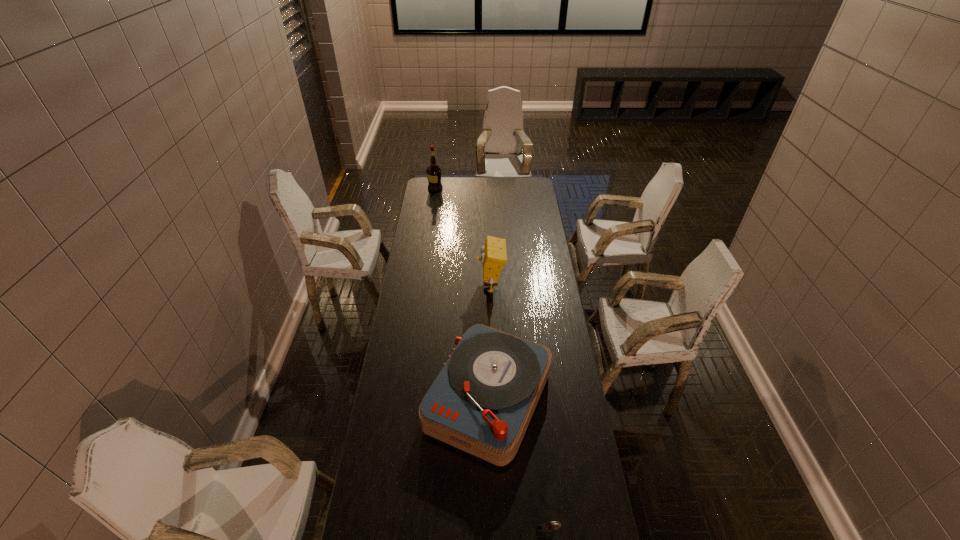
This screenshot has height=540, width=960. I want to click on the tallest object, so click(x=433, y=172).

Locate an element on the screen. the farthest object is located at coordinates (433, 172).

Where is `the third shortest object`? the third shortest object is located at coordinates (493, 254).

Locate an element on the screen. The width and height of the screenshot is (960, 540). the second farthest object is located at coordinates (493, 254).

Image resolution: width=960 pixels, height=540 pixels. Find the location of `the third tallest object`. the third tallest object is located at coordinates (482, 401).

Identify the location of the third farthest object. Image resolution: width=960 pixels, height=540 pixels. (482, 401).

Identify the location of the nearest object. (544, 530).

Locate an element on the screen. The width and height of the screenshot is (960, 540). the shortest object is located at coordinates click(544, 530).

Find the location of a particular element. This screenshot has height=540, width=960. free space located on the label of the tallest object is located at coordinates (452, 188).

Locate an element on the screen. This screenshot has width=960, height=540. vacant region located 0.150m on the face of the second tallest object is located at coordinates (445, 286).